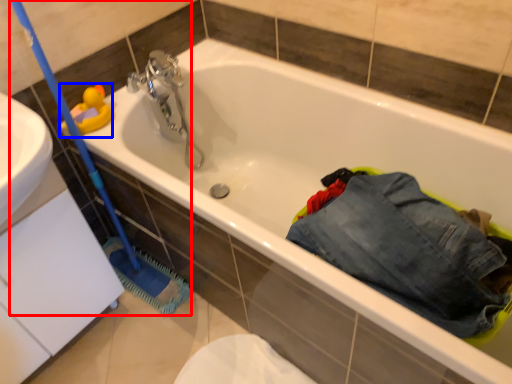
Question: Which of the following is the closest to the observer, brush (highlighted by a red box) or toy (highlighted by a blue box)?

Choices:
 (A) brush
 (B) toy

Answer: (A)